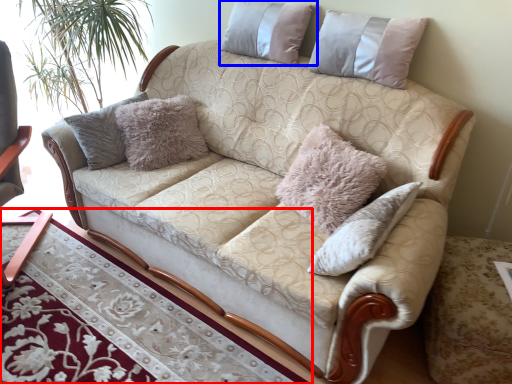
Question: Among these objects, which one is nearest to the camera, table (highlighted by a red box) or pillow (highlighted by a blue box)?

Choices:
 (A) table
 (B) pillow

Answer: (A)